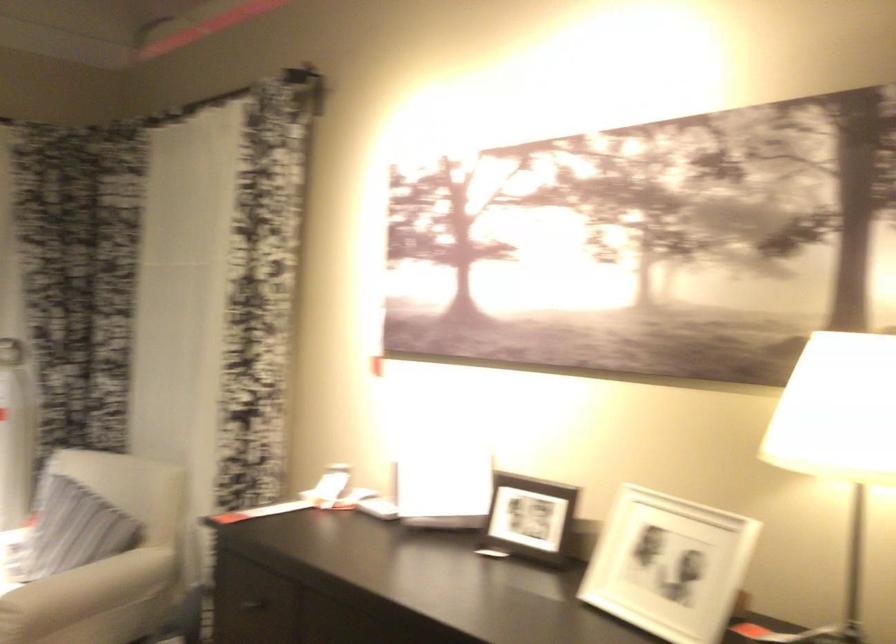
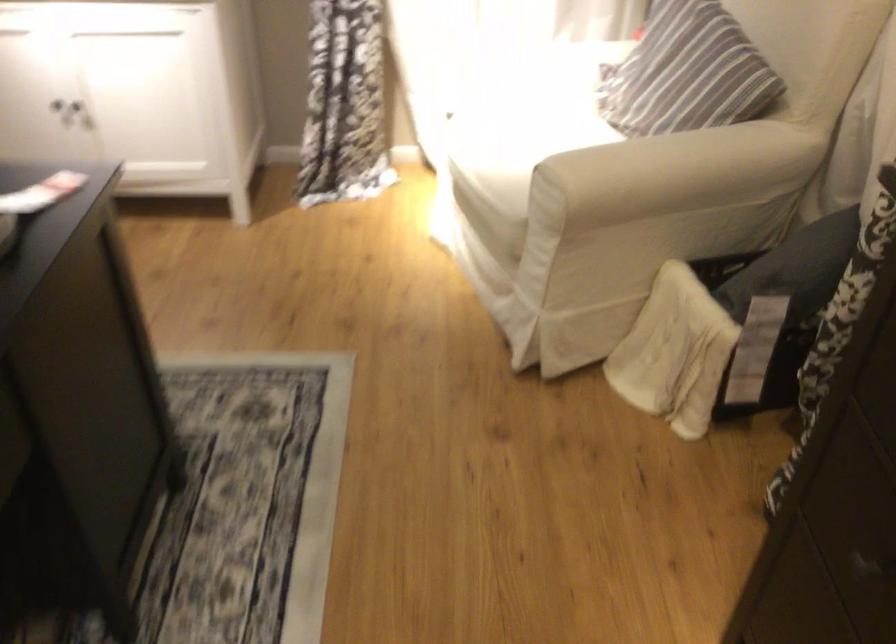
Where in the second image is the point corresponding to point (89, 529) from the first image?

(687, 73)